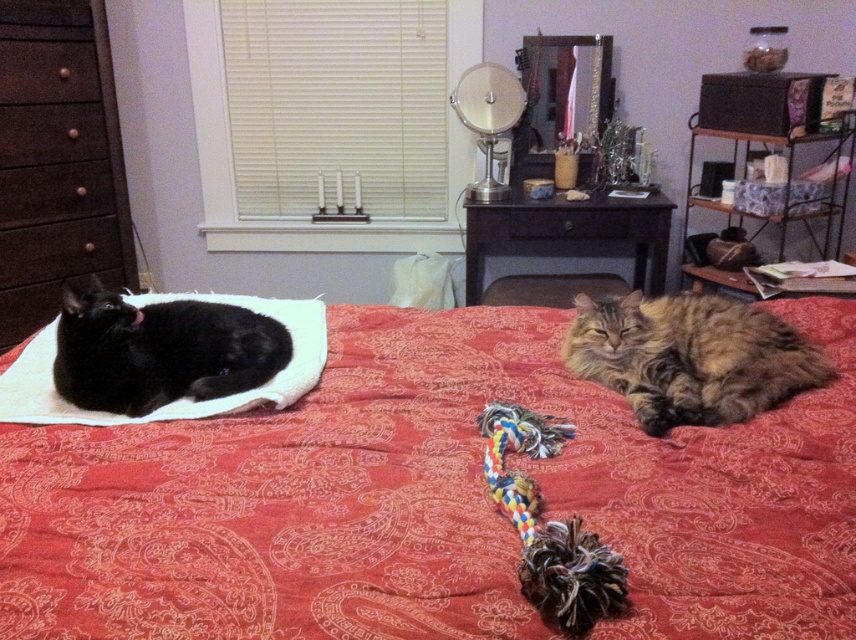
Does dark brown wood dresser at left have a greater width compared to matte black cat at left?

No, dark brown wood dresser at left is not wider than matte black cat at left.

How distant is dark brown wood dresser at left from matte black cat at left?

A distance of 5.01 feet exists between dark brown wood dresser at left and matte black cat at left.

Find the location of a particular element. The width and height of the screenshot is (856, 640). dark brown wood dresser at left is located at coordinates (57, 161).

Image resolution: width=856 pixels, height=640 pixels. Find the location of `dark brown wood dresser at left`. dark brown wood dresser at left is located at coordinates (57, 161).

Can you confirm if matte black cat at left is bigger than brown wood drawer at left?

Yes.

Does matte black cat at left appear on the right side of brown wood drawer at left?

Yes, matte black cat at left is to the right of brown wood drawer at left.

I want to click on matte black cat at left, so pyautogui.click(x=159, y=349).

Between tabby fur cat at center and matte black cat at left, which one appears on the left side from the viewer's perspective?

From the viewer's perspective, matte black cat at left appears more on the left side.

Locate an element on the screen. tabby fur cat at center is located at coordinates (690, 356).

Between point (724, 356) and point (277, 353), which one is positioned in front?

Positioned in front is point (724, 356).

You are a GUI agent. You are given a task and a screenshot of the screen. Output one action in this format:
    pyautogui.click(x=<x>, y=<y>)
    Task: Click on the tabby fur cat at center
    
    Given the screenshot: What is the action you would take?
    pyautogui.click(x=690, y=356)